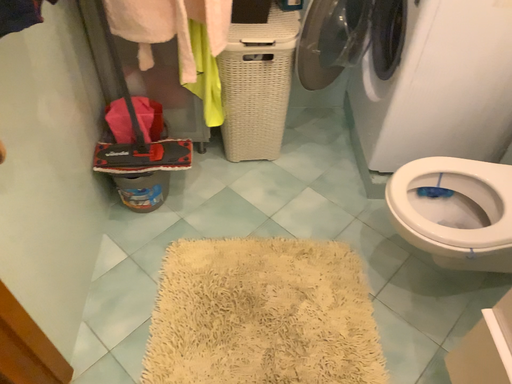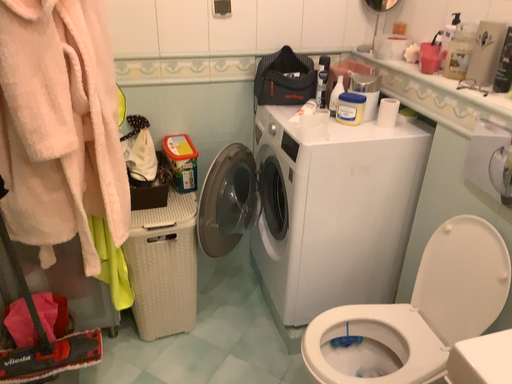
Question: How did the camera likely rotate when shooting the video?

Choices:
 (A) rotated right
 (B) rotated left

Answer: (A)